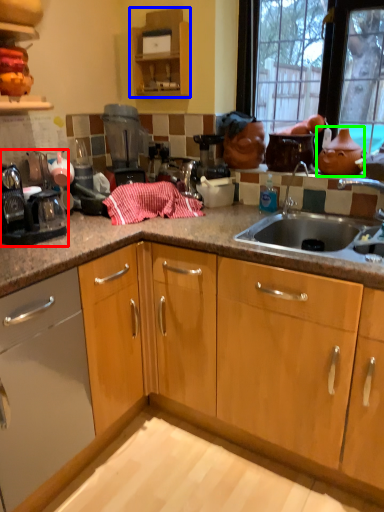
Question: Estimate the real-world distances between objects in this image. Which object is closer to appliance (highlighted by a red box), cabinetry (highlighted by a blue box) or tea pot (highlighted by a green box)?

Choices:
 (A) cabinetry
 (B) tea pot

Answer: (A)